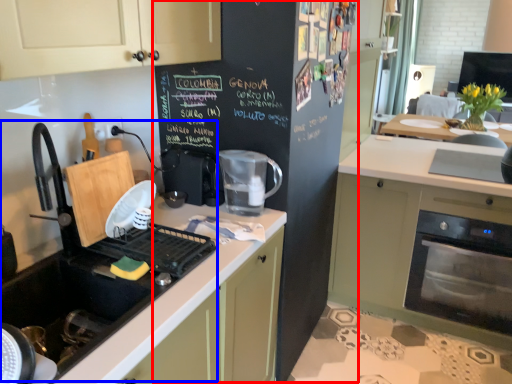
Question: Among these objects, which one is farthest to the camera, bulletin board (highlighted by a red box) or sink (highlighted by a blue box)?

Choices:
 (A) bulletin board
 (B) sink

Answer: (A)